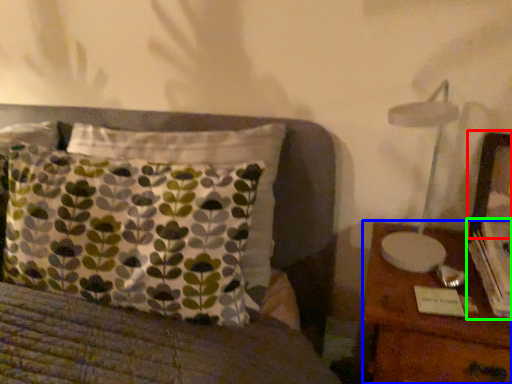
Question: Which object is positioned farthest from picture frame (highlighted by a red box)? Select from nightstand (highlighted by a blue box) and book (highlighted by a green box).

Choices:
 (A) nightstand
 (B) book

Answer: (A)